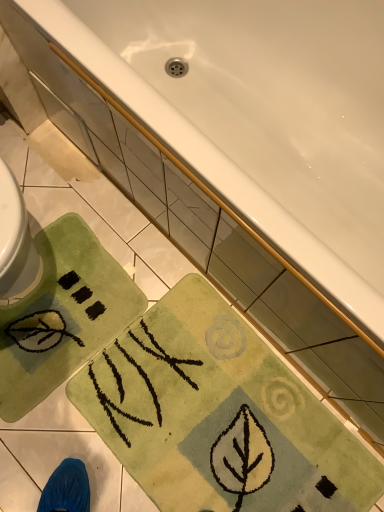
Question: Based on their positions, is green soft rug at lower left, the 2th beach towel from the right, located to the left or right of green soft rug at lower center, placed as the 2th beach towel when sorted from left to right?

Choices:
 (A) left
 (B) right

Answer: (A)

Question: Considering the positions of point (59, 342) and point (115, 399), is point (59, 342) closer or farther from the camera than point (115, 399)?

Choices:
 (A) closer
 (B) farther

Answer: (B)

Question: Estimate the real-world distances between objects in this image. Which object is farther from the green soft rug at lower center, the 1th beach towel viewed from the right?

Choices:
 (A) white glossy bathtub at upper center
 (B) green soft rug at lower left, the 2th beach towel from the right

Answer: (A)

Question: Which object is positioned farthest from the green soft rug at lower left, the 2th beach towel from the right?

Choices:
 (A) white glossy bathtub at upper center
 (B) green soft rug at lower center, placed as the 2th beach towel when sorted from left to right

Answer: (A)